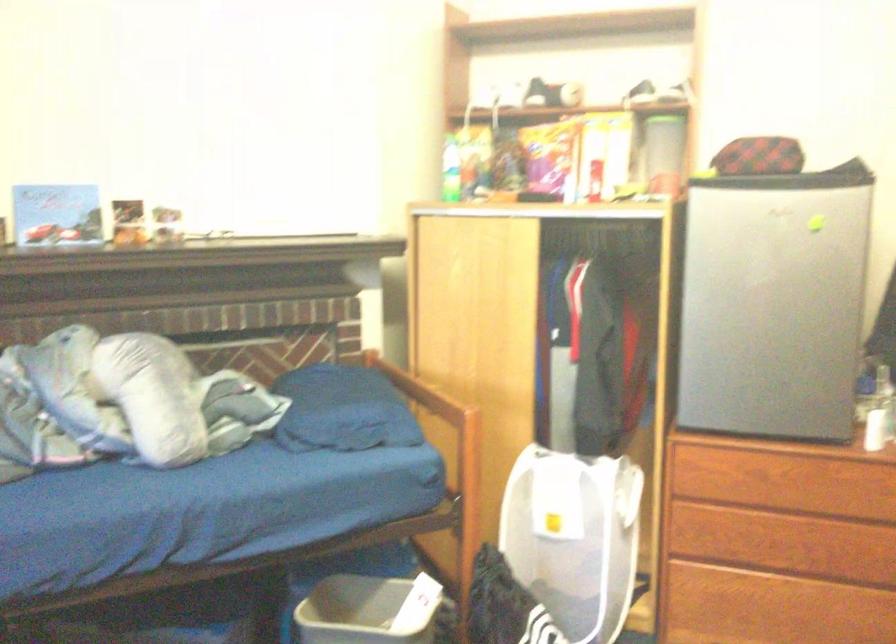
Which object does [368,611] point to?

It refers to a grey plastic bin.